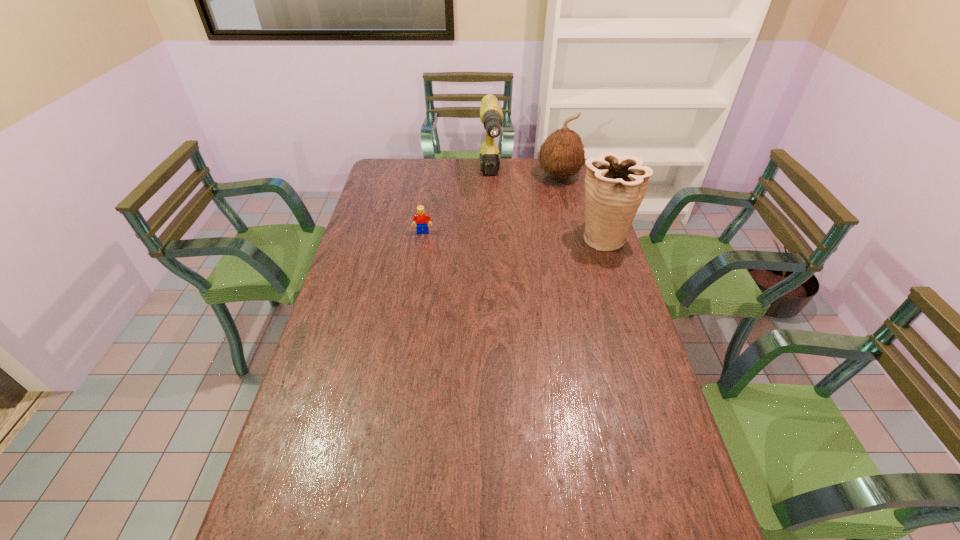
What are the coordinates of `free space between the coconut and the third object from right to left` in the screenshot? It's located at (524, 178).

This screenshot has width=960, height=540. In order to click on free area in between the shortest object and the coconut in this screenshot , I will do `click(491, 204)`.

Identify the location of empty location between the coconut and the third object from right to left. (524, 178).

Find the location of a particular element. The image size is (960, 540). free space between the coconut and the drill is located at coordinates (524, 178).

Find the location of a particular element. The width and height of the screenshot is (960, 540). object that is the closest to the third object from right to left is located at coordinates (562, 154).

What are the coordinates of `object that is the third nearest to the urn` in the screenshot? It's located at (421, 218).

The height and width of the screenshot is (540, 960). Find the location of `vacant space that satisfies the following two spatial constraints: 1. on the back side of the drill; 2. on the left side of the coconut`. vacant space that satisfies the following two spatial constraints: 1. on the back side of the drill; 2. on the left side of the coconut is located at coordinates coord(491,176).